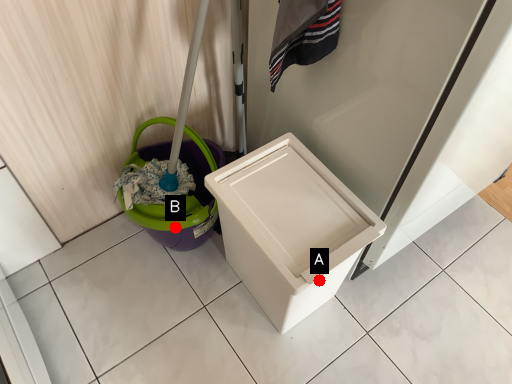
Question: Two points are circled on the image, labeled by A and B beside each circle. Which point appears farthest from the camera in this image?

Choices:
 (A) A is further
 (B) B is further

Answer: (B)